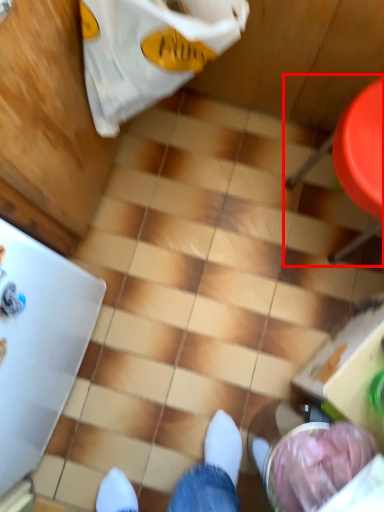
Question: From the image's perspective, what is the correct spatial positioning of chair (annotated by the red box) in reference to grocery bag?

Choices:
 (A) above
 (B) below

Answer: (B)